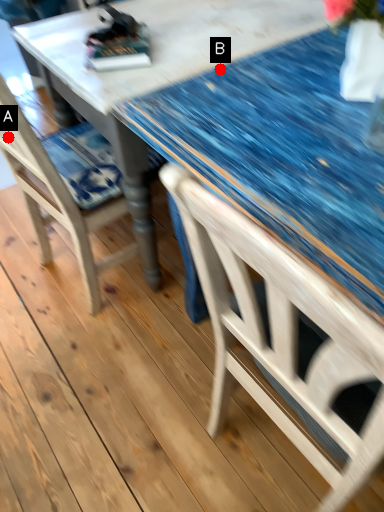
Question: Two points are circled on the image, labeled by A and B beside each circle. Among these points, which one is nearest to the camera?

Choices:
 (A) A is closer
 (B) B is closer

Answer: (B)